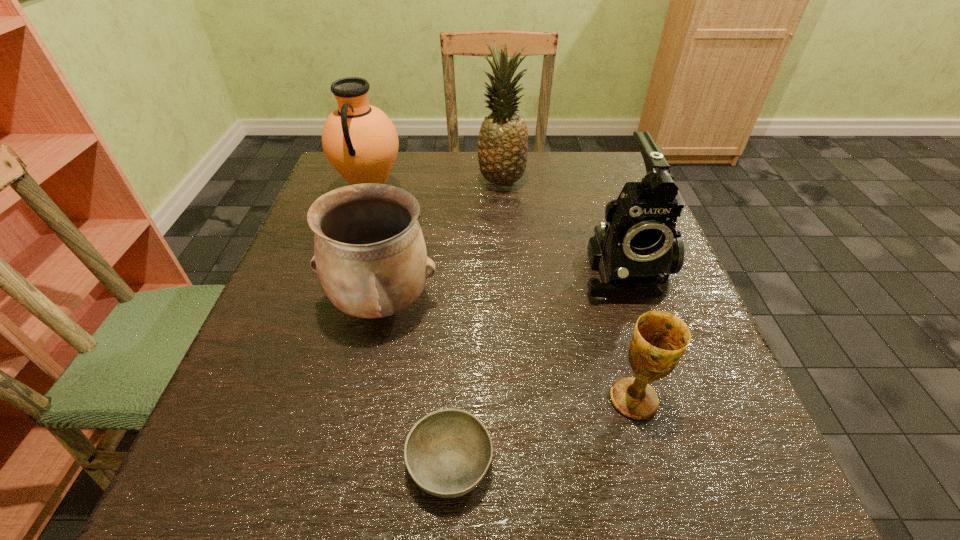
You are a GUI agent. You are given a task and a screenshot of the screen. Output one action in this format:
    pyautogui.click(x=<x>, y=<y>)
    Task: Click on the pineapple
    The image size is (960, 540).
    Given the screenshot: What is the action you would take?
    pyautogui.click(x=502, y=150)

Locate an element on the screen. The image size is (960, 540). pitcher is located at coordinates [x=360, y=141].

Find the location of a particular element. This screenshot has width=960, height=540. camcorder is located at coordinates (637, 248).

This screenshot has width=960, height=540. I want to click on urn, so click(370, 254).

This screenshot has height=540, width=960. I want to click on the second nearest object, so click(659, 340).

Image resolution: width=960 pixels, height=540 pixels. Identify the location of chalice. (659, 340).

What are the coordinates of `the nearest object` in the screenshot? It's located at (448, 452).

The height and width of the screenshot is (540, 960). I want to click on the shortest object, so click(x=448, y=452).

Where is `free region located on the left of the pineapple`? The width and height of the screenshot is (960, 540). free region located on the left of the pineapple is located at coordinates (459, 182).

Identify the location of free region located on the front of the pitcher. This screenshot has width=960, height=540. (356, 245).